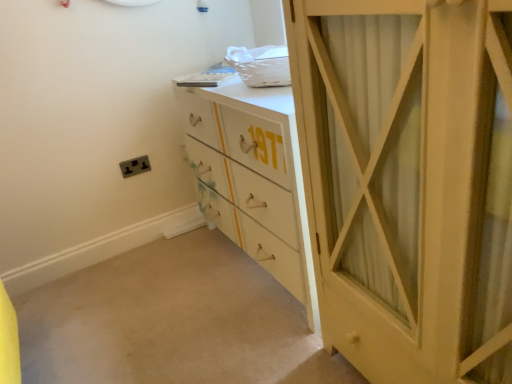
The width and height of the screenshot is (512, 384). Describe the element at coordinates (254, 175) in the screenshot. I see `white painted wood chest of drawers at center` at that location.

You are a GUI agent. You are given a task and a screenshot of the screen. Output one action in this format:
    pyautogui.click(x=<x>, y=<y>)
    Task: Click on the matte white cabinet at right
    
    Given the screenshot: What is the action you would take?
    pos(406,182)

Looking at their sizes, would you say matte black socket at lower left is wider or thinner than white painted wood chest of drawers at center?

Clearly, matte black socket at lower left has less width compared to white painted wood chest of drawers at center.

In the scene shown: Looking at the image, does matte black socket at lower left seem bigger or smaller compared to white painted wood chest of drawers at center?

Considering their sizes, matte black socket at lower left takes up less space than white painted wood chest of drawers at center.

From a real-world perspective, is matte black socket at lower left located beneath white painted wood chest of drawers at center?

Actually, matte black socket at lower left is physically above white painted wood chest of drawers at center in the real world.

Is matte black socket at lower left spatially inside white painted wood chest of drawers at center, or outside of it?

matte black socket at lower left exists outside the volume of white painted wood chest of drawers at center.

Considering the relative positions of matte white cabinet at right and matte black socket at lower left in the image provided, is matte white cabinet at right to the right of matte black socket at lower left from the viewer's perspective?

Correct, you'll find matte white cabinet at right to the right of matte black socket at lower left.

Which object is thinner, matte white cabinet at right or matte black socket at lower left?

Thinner between the two is matte black socket at lower left.

Is matte white cabinet at right positioned before matte black socket at lower left?

Yes.

Would you consider matte white cabinet at right to be distant from matte black socket at lower left?

matte white cabinet at right is far away from matte black socket at lower left.

From the image's perspective, is white painted wood chest of drawers at center beneath matte black socket at lower left?

Yes, from the image's perspective, white painted wood chest of drawers at center is below matte black socket at lower left.

Is white painted wood chest of drawers at center outside of matte black socket at lower left?

Yes, white painted wood chest of drawers at center is outside of matte black socket at lower left.

Considering the sizes of objects white painted wood chest of drawers at center and matte black socket at lower left in the image provided, who is smaller, white painted wood chest of drawers at center or matte black socket at lower left?

With smaller size is matte black socket at lower left.

Can you confirm if white painted wood chest of drawers at center is taller than matte black socket at lower left?

Yes, white painted wood chest of drawers at center is taller than matte black socket at lower left.

Would you consider white painted wood chest of drawers at center to be distant from matte white cabinet at right?

No, white painted wood chest of drawers at center is not far away from matte white cabinet at right.

Looking at the image, does white painted wood chest of drawers at center seem bigger or smaller compared to matte white cabinet at right?

Clearly, white painted wood chest of drawers at center is larger in size than matte white cabinet at right.

Does white painted wood chest of drawers at center come in front of matte white cabinet at right?

No, the depth of white painted wood chest of drawers at center is greater than that of matte white cabinet at right.

Who is taller, white painted wood chest of drawers at center or matte white cabinet at right?

matte white cabinet at right is taller.

Is matte white cabinet at right next to white painted wood chest of drawers at center?

matte white cabinet at right is not next to white painted wood chest of drawers at center, and they're not touching.

Is matte white cabinet at right turned away from white painted wood chest of drawers at center?

No.

Considering the sizes of objects matte white cabinet at right and white painted wood chest of drawers at center in the image provided, who is taller, matte white cabinet at right or white painted wood chest of drawers at center?

matte white cabinet at right.

Considering the relative sizes of matte black socket at lower left and matte white cabinet at right in the image provided, is matte black socket at lower left taller than matte white cabinet at right?

No, matte black socket at lower left is not taller than matte white cabinet at right.

Considering the relative sizes of matte black socket at lower left and matte white cabinet at right in the image provided, is matte black socket at lower left thinner than matte white cabinet at right?

Correct, the width of matte black socket at lower left is less than that of matte white cabinet at right.

Is matte black socket at lower left further to the viewer compared to matte white cabinet at right?

That is True.

You are a GUI agent. You are given a task and a screenshot of the screen. Output one action in this format:
    pyautogui.click(x=<x>, y=<y>)
    Task: Click on the electric outlet on the left of matte white cabinet at right
    This screenshot has width=512, height=384.
    Given the screenshot: What is the action you would take?
    tap(135, 166)

The width and height of the screenshot is (512, 384). Identify the location of the chest of drawers directly beneath the matte black socket at lower left (from a real-world perspective). (254, 175).

I want to click on electric outlet lying behind the matte white cabinet at right, so click(135, 166).

Looking at the image, which one is located closer to matte white cabinet at right, matte black socket at lower left or white painted wood chest of drawers at center?

Among the two, white painted wood chest of drawers at center is located nearer to matte white cabinet at right.

Which object lies further to the anchor point matte white cabinet at right, white painted wood chest of drawers at center or matte black socket at lower left?

The object further to matte white cabinet at right is matte black socket at lower left.

From the picture: Based on their spatial positions, is white painted wood chest of drawers at center or matte white cabinet at right further from matte black socket at lower left?

Based on the image, matte white cabinet at right appears to be further to matte black socket at lower left.

From the image, which object appears to be farther from white painted wood chest of drawers at center, matte black socket at lower left or matte white cabinet at right?

matte black socket at lower left lies further to white painted wood chest of drawers at center than the other object.

Considering their positions, is matte white cabinet at right positioned further to matte black socket at lower left than white painted wood chest of drawers at center?

matte white cabinet at right.

Considering their positions, is matte white cabinet at right positioned closer to white painted wood chest of drawers at center than matte black socket at lower left?

matte white cabinet at right is positioned closer to the anchor white painted wood chest of drawers at center.

What are the coordinates of `chest of drawers between matte white cabinet at right and matte black socket at lower left from front to back` in the screenshot? It's located at (254, 175).